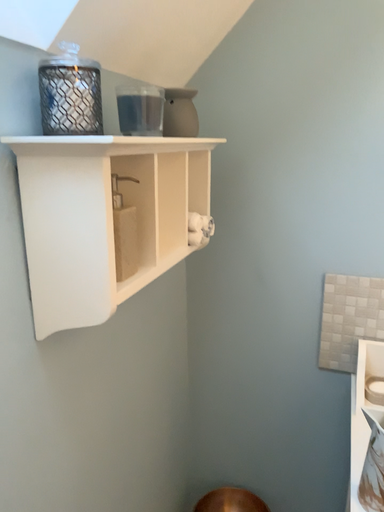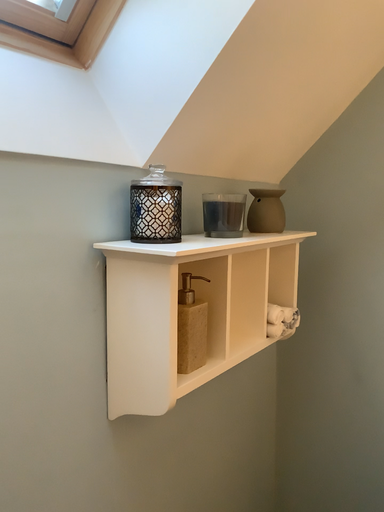
Question: Which way did the camera rotate in the video?

Choices:
 (A) rotated upward
 (B) rotated downward

Answer: (A)